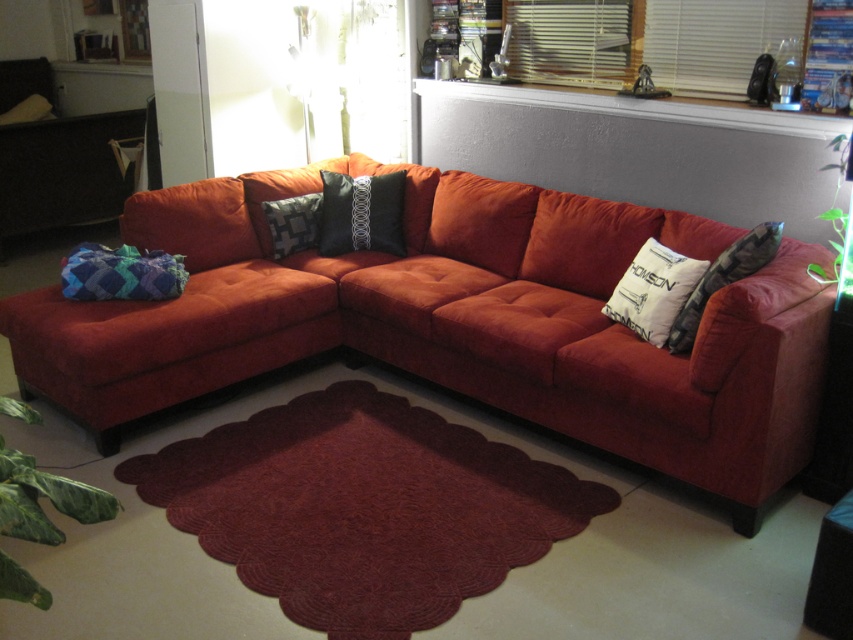
Question: Does white printed pillow at right lie behind dark gray textured pillow at upper left?

Choices:
 (A) no
 (B) yes

Answer: (A)

Question: Which is nearer to the knitted wool pillow at left?

Choices:
 (A) dark gray textured pillow at upper left
 (B) white cotton pillow at center
 (C) black satin pillow at center
 (D) velvet orange couch at center

Answer: (D)

Question: Is black satin pillow at center behind dark gray textured pillow at upper left?

Choices:
 (A) yes
 (B) no

Answer: (B)

Question: Among these points, which one is nearest to the camera?

Choices:
 (A) (703, 260)
 (B) (299, 198)
 (C) (582, 209)

Answer: (A)

Question: Does knitted wool pillow at left have a larger size compared to dark gray textured pillow at upper left?

Choices:
 (A) no
 (B) yes

Answer: (A)

Question: Which object is positioned closest to the satin black pillow at center?

Choices:
 (A) knitted wool pillow at left
 (B) dark gray textured pillow at upper left
 (C) velvet orange couch at center
 (D) white cotton pillow at center

Answer: (C)